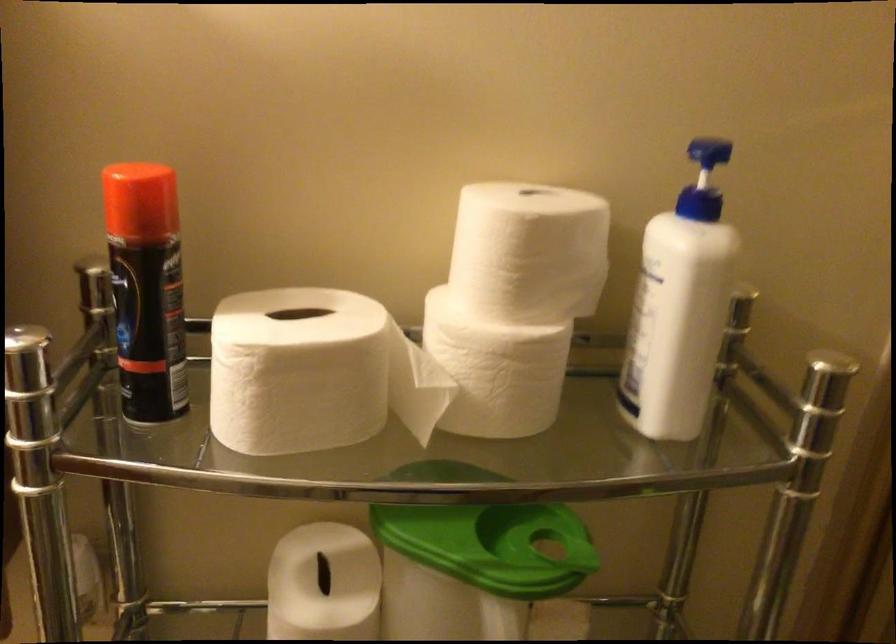
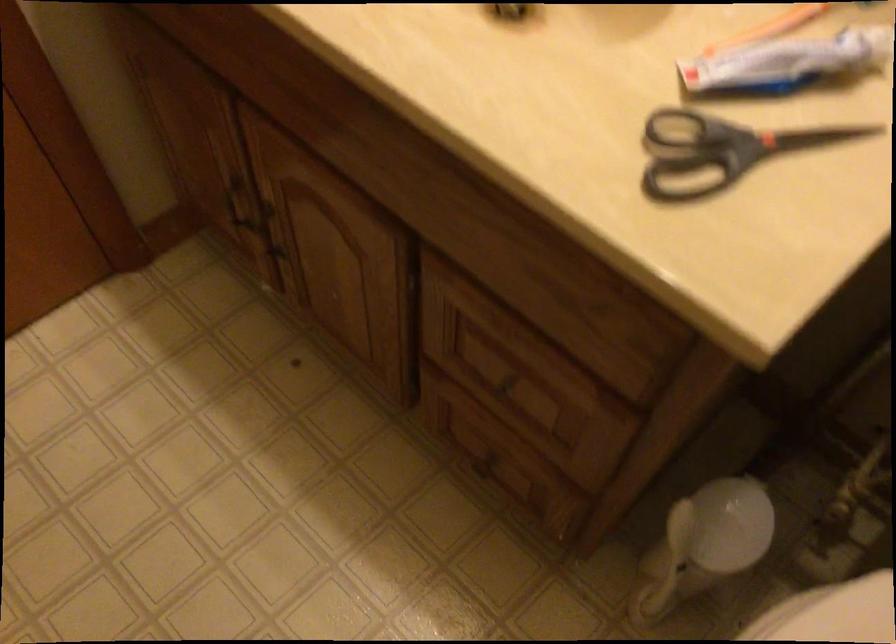
Based on the continuous images, in which direction is the camera rotating?

The camera's rotation is toward left-down.